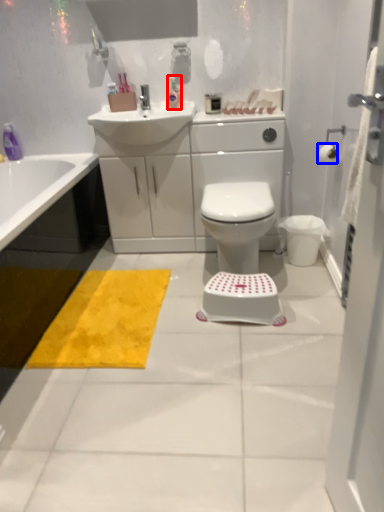
Question: Which object is closer to the camera taking this photo, toiletry (highlighted by a red box) or toilet paper (highlighted by a blue box)?

Choices:
 (A) toiletry
 (B) toilet paper

Answer: (B)